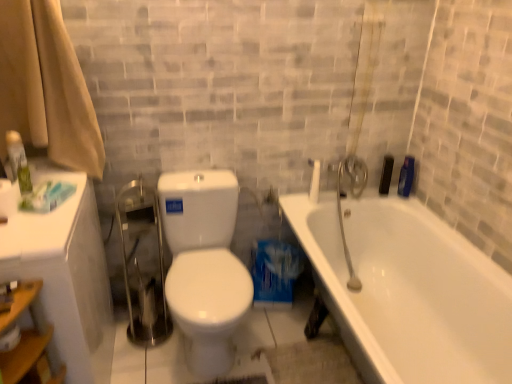
Question: Relative to beige fabric shower curtain at left, is green matte spray can at left, which appears as the first toiletry when viewed from the front, in front or behind?

Choices:
 (A) behind
 (B) front

Answer: (A)

Question: Does point (17, 135) appear closer or farther from the camera than point (6, 117)?

Choices:
 (A) farther
 (B) closer

Answer: (B)

Question: Estimate the real-world distances between objects in this image. Which object is closer to the white matte toilet paper at lower left?

Choices:
 (A) black plastic razor at upper right, which is the third toiletry in front-to-back order
 (B) beige fabric shower curtain at left
 (C) white glossy toilet at center
 (D) green matte spray can at left, which appears as the first toiletry when viewed from the front
 (E) white glossy bathtub at right

Answer: (D)

Question: Based on their relative distances, which object is farther from the white matte toilet paper at lower left?

Choices:
 (A) green matte spray can at left, arranged as the first toiletry when viewed from the left
 (B) white glossy toilet at center
 (C) white glossy medicine cabinet at left
 (D) black plastic razor at upper right, placed as the 1th toiletry when sorted from back to front
 (E) beige fabric shower curtain at left

Answer: (D)